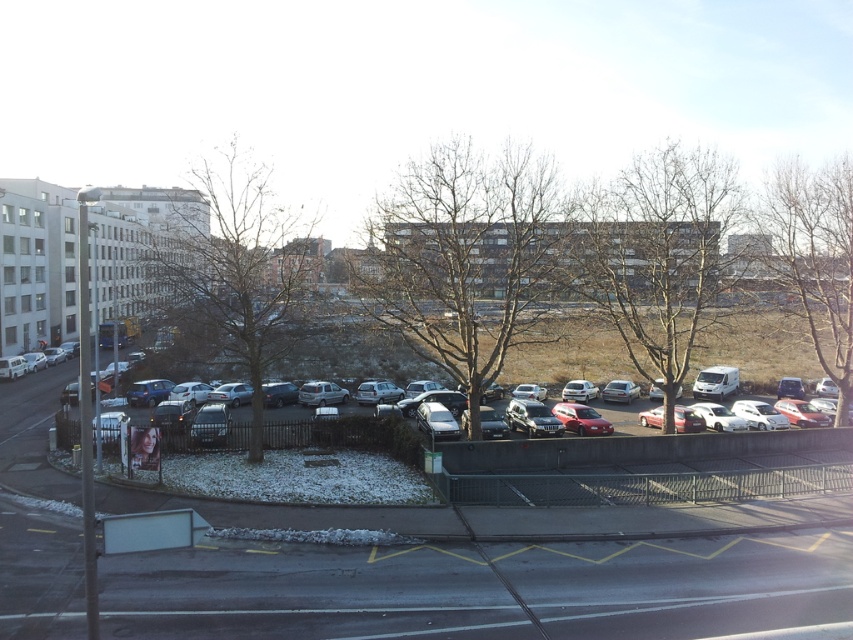
Question: Among these objects, which one is nearest to the camera?

Choices:
 (A) satin silver car at center
 (B) white matte parking lot at center
 (C) satin silver suv at center
 (D) satin silver sedan at center

Answer: (B)

Question: From the image, what is the correct spatial relationship of matte red car at center in relation to satin silver sedan at center?

Choices:
 (A) below
 (B) above

Answer: (A)

Question: Is white matte parking lot at center thinner than satin silver suv at center?

Choices:
 (A) yes
 (B) no

Answer: (B)

Question: Which of the following is the closest to the observer?

Choices:
 (A) (524, 422)
 (B) (328, 397)
 (C) (793, 509)
 (D) (578, 381)

Answer: (C)

Question: Observing the image, what is the correct spatial positioning of white matte parking lot at center in reference to satin silver sedan at center?

Choices:
 (A) above
 (B) below

Answer: (B)

Question: Which object appears closest to the camera in this image?

Choices:
 (A) white matte parking lot at center
 (B) matte red car at center
 (C) satin silver suv at center
 (D) satin silver car at center

Answer: (A)